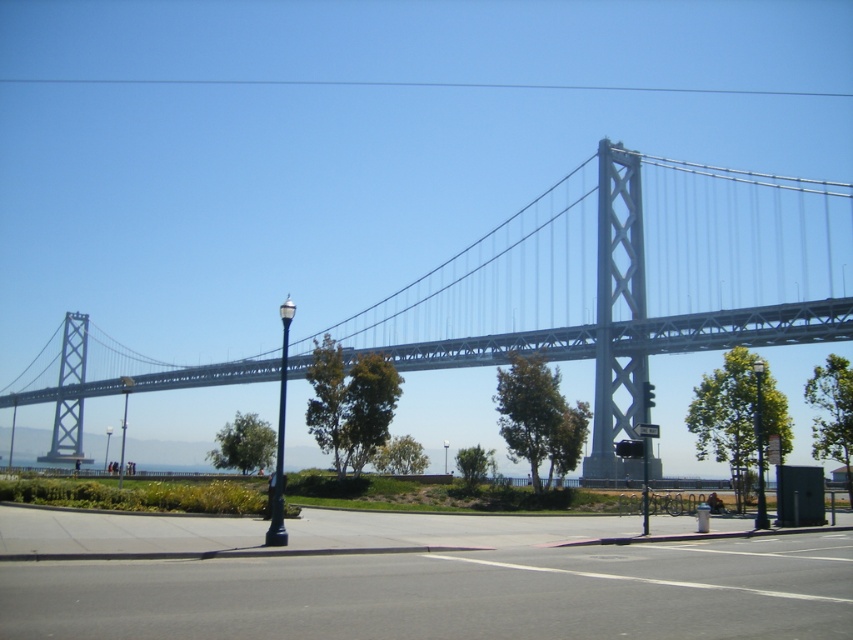
You are standing at the center of the sidewalk and want to reach the black metal lamp post at right. According to the coordinates provided, in which direction should you walk to reach it?

The black metal lamp post at right is located at coordinates point (x=759, y=448). Since you are at the center of the sidewalk, you should walk towards the right side to reach the black metal lamp post at right.

You are a pedestrian standing on the sidewalk and want to walk towards the bridge. Which object will you pass first, the polished metal streetlight at center or the red glass traffic light at center?

The polished metal streetlight at center is to the left of the red glass traffic light at center, so you will pass the polished metal streetlight at center first as you walk towards the bridge.

You are standing on the sidewalk and want to take a photo of both the metallic gray bridge at center and the metallic streetlight at center. Which object should you focus on first to ensure both are in clear view?

You should focus on the metallic gray bridge at center first since it is closer to the viewer than the metallic streetlight at center, allowing both to be in clear focus when adjusting the camera settings accordingly.